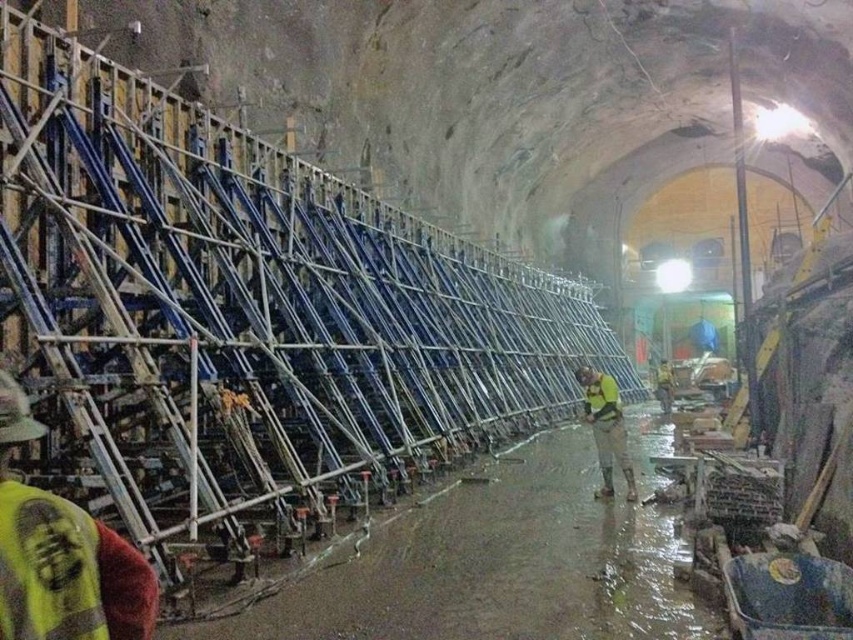
You are a worker standing at the entrance of the tunnel. You need to locate your yellow reflective safety vest at lower left. According to the coordinates provided, where exactly should you look to find it?

The yellow reflective safety vest at lower left is located at coordinates point (47, 566), so you should look there to find it.